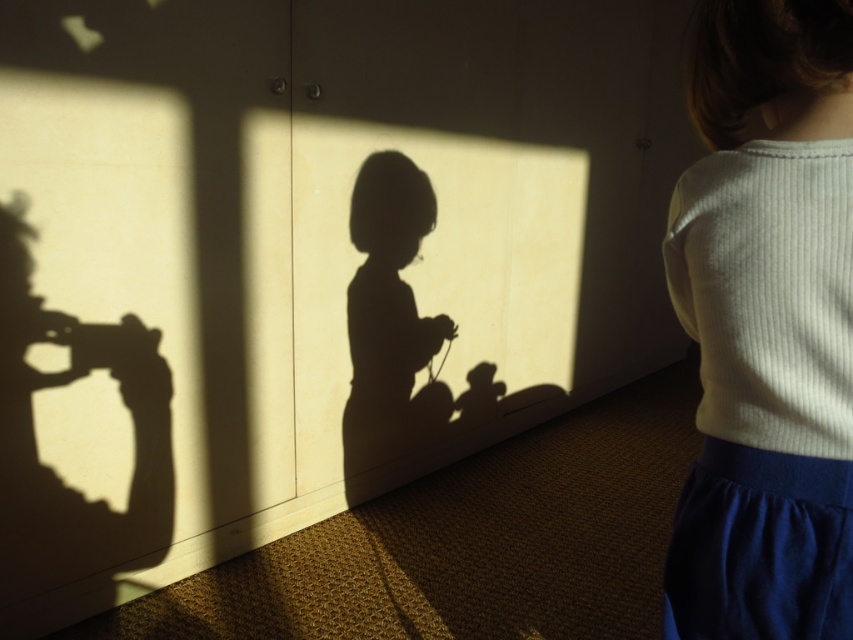
Does white ribbed sweater at upper right have a lesser width compared to matte black camera at left?

Indeed, white ribbed sweater at upper right has a lesser width compared to matte black camera at left.

The width and height of the screenshot is (853, 640). What do you see at coordinates (766, 326) in the screenshot?
I see `white ribbed sweater at upper right` at bounding box center [766, 326].

This screenshot has width=853, height=640. In order to click on white ribbed sweater at upper right in this screenshot , I will do `click(766, 326)`.

Which is above, matte black camera at left or silhouette figure at center?

Positioned higher is silhouette figure at center.

Can you confirm if matte black camera at left is positioned below silhouette figure at center?

Yes.

Where is `matte black camera at left`? The image size is (853, 640). matte black camera at left is located at coordinates (36, 440).

Identify the location of matte black camera at left. (36, 440).

Can you confirm if white ribbed sweater at upper right is positioned to the left of silhouette figure at center?

Incorrect, white ribbed sweater at upper right is not on the left side of silhouette figure at center.

Is point (799, 444) less distant than point (404, 442)?

Yes, it is.

Which is in front, point (704, 584) or point (378, 403)?

Positioned in front is point (704, 584).

Where is `white ribbed sweater at upper right`? The image size is (853, 640). white ribbed sweater at upper right is located at coordinates (766, 326).